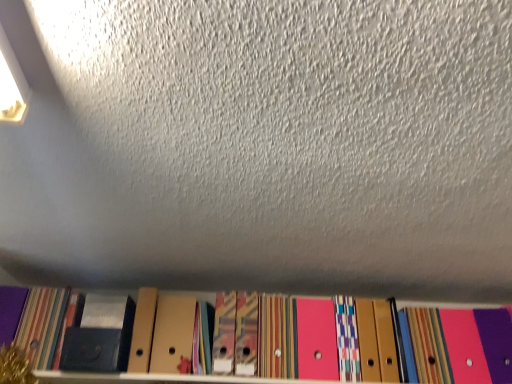
Question: Based on their sizes in the image, would you say matte black paperback book at lower left, the second paperback book positioned from the left, is bigger or smaller than matte black paperback book at lower left, the second paperback book when ordered from right to left?

Choices:
 (A) small
 (B) big

Answer: (A)

Question: From the image's perspective, relative to matte black paperback book at lower left, which appears as the 1th paperback book when viewed from the left, is matte black paperback book at lower left, which is the first paperback book from right to left, above or below?

Choices:
 (A) above
 (B) below

Answer: (B)

Question: Which object is positioned farthest from the matte black paperback book at lower left, the second paperback book when ordered from right to left?

Choices:
 (A) cardboard folders at lower center
 (B) matte black paperback book at lower left, which is the first paperback book from right to left

Answer: (A)

Question: Which is nearer to the cardboard folders at lower center?

Choices:
 (A) matte black paperback book at lower left, the second paperback book when ordered from right to left
 (B) matte black paperback book at lower left, the second paperback book positioned from the left

Answer: (B)